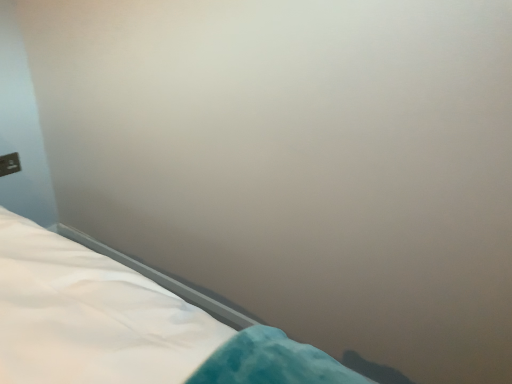
Question: Should I look upward or downward to see matte black outlet at upper left?

Choices:
 (A) up
 (B) down

Answer: (A)

Question: Can you confirm if white fabric bed at lower left is positioned to the left of matte black outlet at upper left?

Choices:
 (A) yes
 (B) no

Answer: (B)

Question: Is white fabric bed at lower left smaller than matte black outlet at upper left?

Choices:
 (A) yes
 (B) no

Answer: (B)

Question: From a real-world perspective, is white fabric bed at lower left positioned over matte black outlet at upper left based on gravity?

Choices:
 (A) yes
 (B) no

Answer: (B)

Question: Is white fabric bed at lower left not within matte black outlet at upper left?

Choices:
 (A) yes
 (B) no

Answer: (A)

Question: Is white fabric bed at lower left next to matte black outlet at upper left and touching it?

Choices:
 (A) yes
 (B) no

Answer: (B)

Question: Does white fabric bed at lower left have a lesser width compared to matte black outlet at upper left?

Choices:
 (A) yes
 (B) no

Answer: (B)

Question: From the image's perspective, is matte black outlet at upper left beneath white fabric bed at lower left?

Choices:
 (A) yes
 (B) no

Answer: (B)

Question: Considering the relative sizes of matte black outlet at upper left and white fabric bed at lower left in the image provided, is matte black outlet at upper left thinner than white fabric bed at lower left?

Choices:
 (A) no
 (B) yes

Answer: (B)

Question: Is matte black outlet at upper left aimed at white fabric bed at lower left?

Choices:
 (A) yes
 (B) no

Answer: (B)

Question: Would you say white fabric bed at lower left is part of matte black outlet at upper left's contents?

Choices:
 (A) yes
 (B) no

Answer: (B)

Question: From the image's perspective, is matte black outlet at upper left on top of white fabric bed at lower left?

Choices:
 (A) no
 (B) yes

Answer: (B)

Question: Is matte black outlet at upper left touching white fabric bed at lower left?

Choices:
 (A) no
 (B) yes

Answer: (A)

Question: Based on their sizes in the image, would you say white fabric bed at lower left is bigger or smaller than matte black outlet at upper left?

Choices:
 (A) big
 (B) small

Answer: (A)